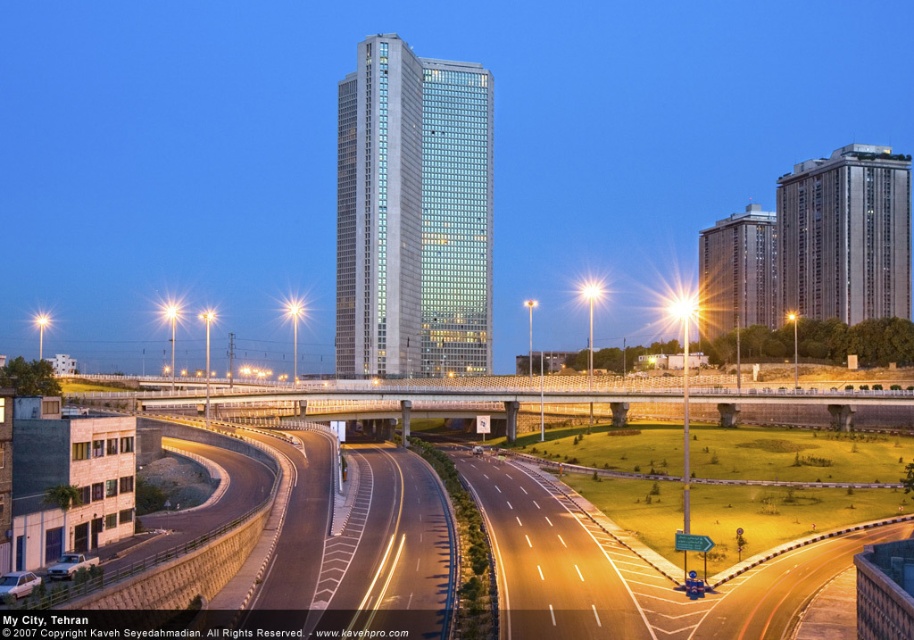
Question: Which of the following is the closest to the observer?

Choices:
 (A) glassy concrete skyscraper at center
 (B) sleek silver building at upper right

Answer: (A)

Question: From the image, what is the correct spatial relationship of glassy concrete skyscraper at center in relation to sleek silver building at upper right?

Choices:
 (A) left
 (B) right

Answer: (A)

Question: In this image, where is glassy concrete skyscraper at center located relative to sleek silver building at upper right?

Choices:
 (A) right
 (B) left

Answer: (B)

Question: Which object appears farthest from the camera in this image?

Choices:
 (A) sleek silver building at upper right
 (B) glassy concrete skyscraper at center

Answer: (A)

Question: Where is glassy concrete skyscraper at center located in relation to sleek silver building at upper right in the image?

Choices:
 (A) above
 (B) below

Answer: (B)